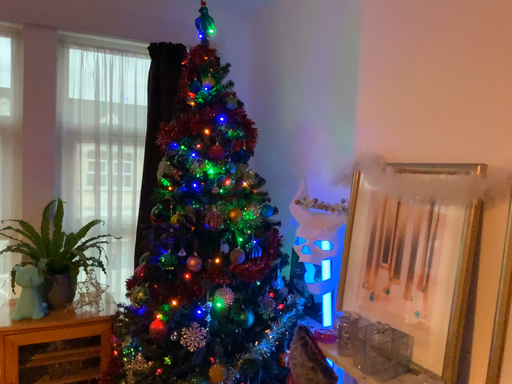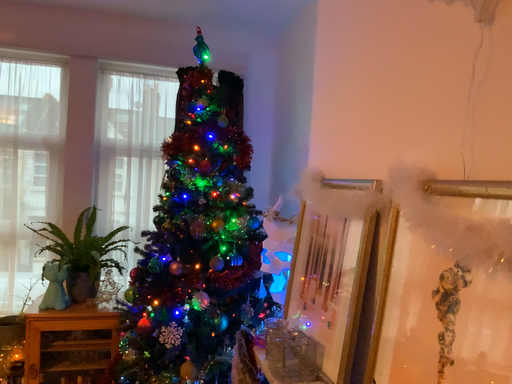
Question: Which way did the camera rotate in the video?

Choices:
 (A) rotated left
 (B) rotated right

Answer: (A)